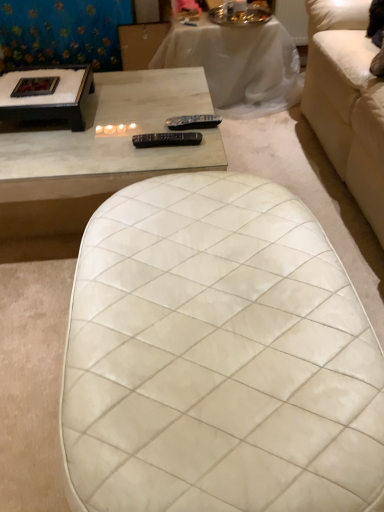
Find the location of a particular element. The width and height of the screenshot is (384, 512). free location to the left of black plastic remote at center, the 2th remote viewed from the top is located at coordinates (115, 147).